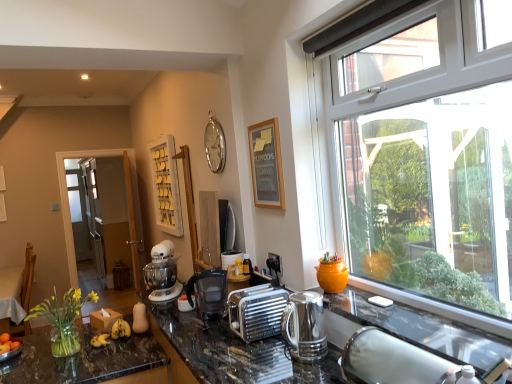
The image size is (512, 384). Find the location of `free space above translucent glass countertop at lower left (from a real-world perspective)`. free space above translucent glass countertop at lower left (from a real-world perspective) is located at coordinates (66, 358).